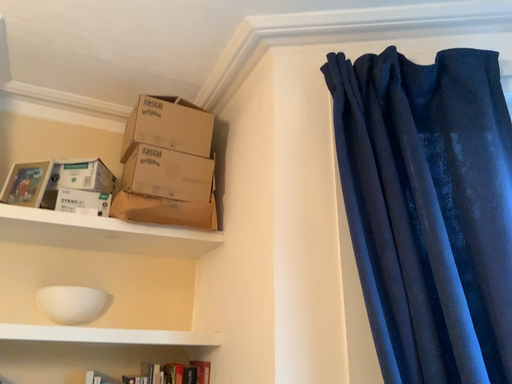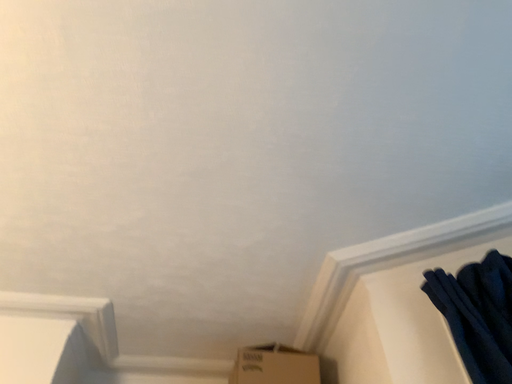
Question: How did the camera likely rotate when shooting the video?

Choices:
 (A) rotated right
 (B) rotated left

Answer: (B)